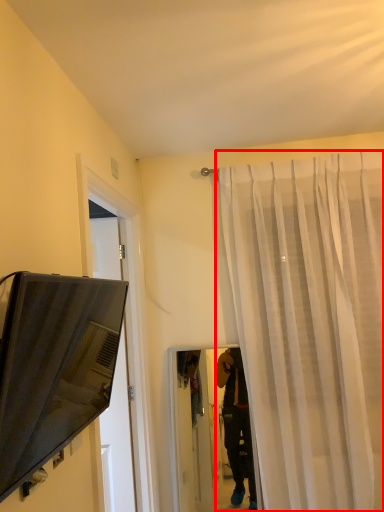
Question: From the image's perspective, where is curtain (annotated by the red box) located relative to television?

Choices:
 (A) above
 (B) below

Answer: (B)